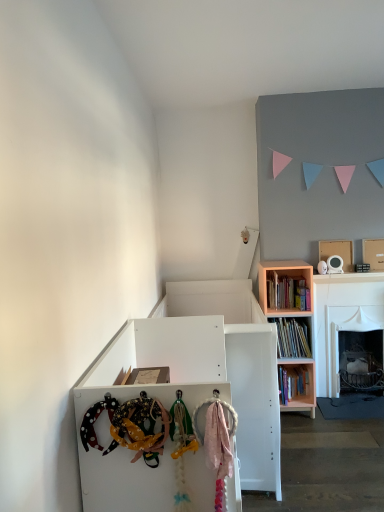
Question: In terms of height, does pink matte bookshelf at upper right look taller or shorter compared to polka dot fabric headband at lower left?

Choices:
 (A) short
 (B) tall

Answer: (B)

Question: From the image's perspective, is pink matte bookshelf at upper right above or below polka dot fabric headband at lower left?

Choices:
 (A) above
 (B) below

Answer: (A)

Question: Which is nearer to the pink wood bookcase at right?

Choices:
 (A) white cardboard box at upper right
 (B) pink matte bookshelf at upper right
 (C) white matte cabinet at center
 (D) polka dot fabric headband at lower left

Answer: (B)

Question: Which object is positioned closest to the white cardboard box at upper right?

Choices:
 (A) polka dot fabric headband at lower left
 (B) pink wood bookcase at right
 (C) pink matte bookshelf at upper right
 (D) white matte cabinet at center

Answer: (C)